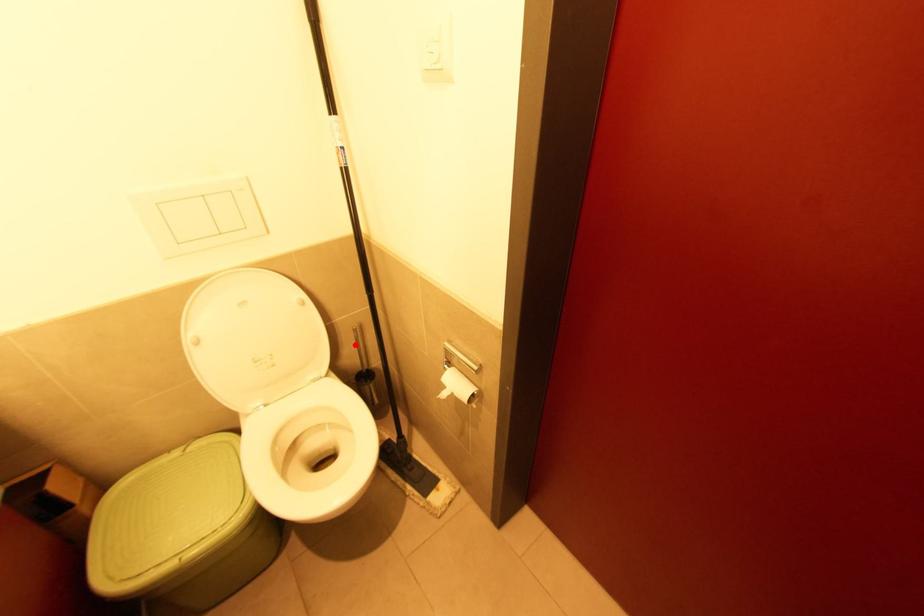
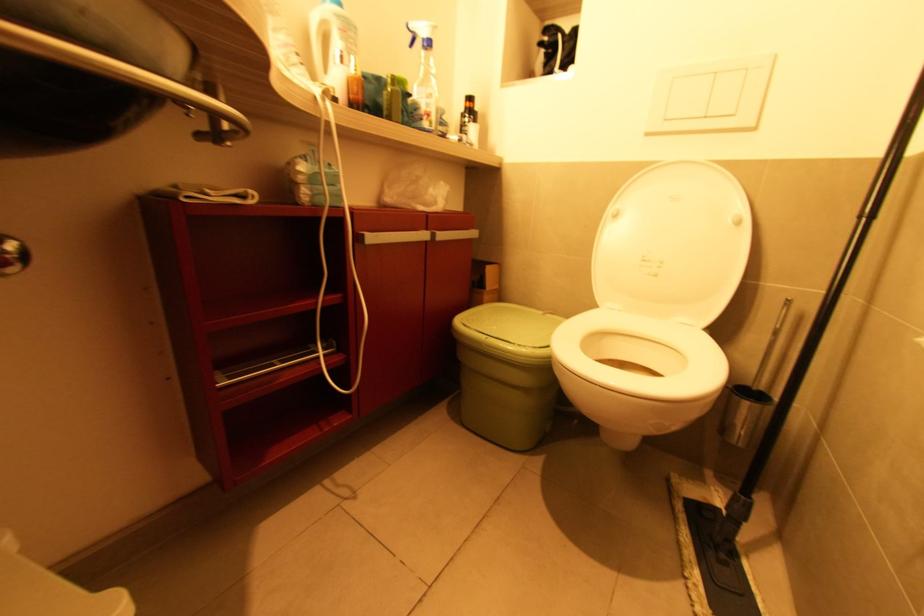
Find the pixel in the second image that matches the highlighted location in the first image.

(771, 338)